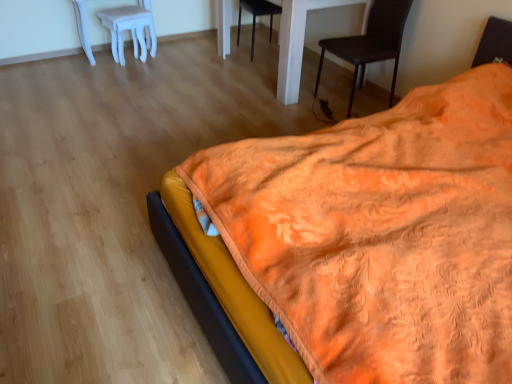
Locate an element on the screen. vacant area that is in front of white plastic stool at upper left is located at coordinates (130, 74).